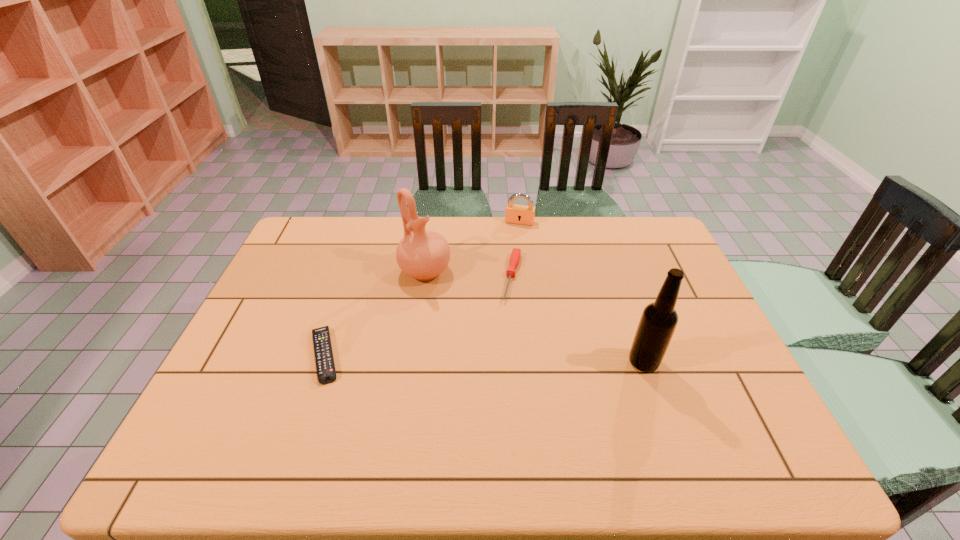
Where is `vacant space on the desktop that is between the remote control and the beer bottle and is positioned on the spout of the pottery`? The width and height of the screenshot is (960, 540). vacant space on the desktop that is between the remote control and the beer bottle and is positioned on the spout of the pottery is located at coordinates (523, 359).

Where is `vacant space on the desktop that is between the shortest object and the beer bottle and is positioned to unlock the third tallest object from the front`? vacant space on the desktop that is between the shortest object and the beer bottle and is positioned to unlock the third tallest object from the front is located at coordinates (482, 358).

Find the location of a particular element. The image size is (960, 540). free spot on the desktop that is between the remote control and the rightmost object and is positioned at the tip of the second shortest object is located at coordinates (491, 359).